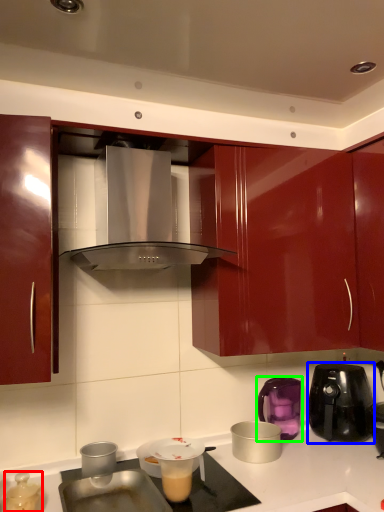
Question: Which object is the farthest from kitchen appliance (highlighted by a red box)? Choose among these: kitchen appliance (highlighted by a blue box) or kitchen appliance (highlighted by a green box).

Choices:
 (A) kitchen appliance
 (B) kitchen appliance

Answer: (A)